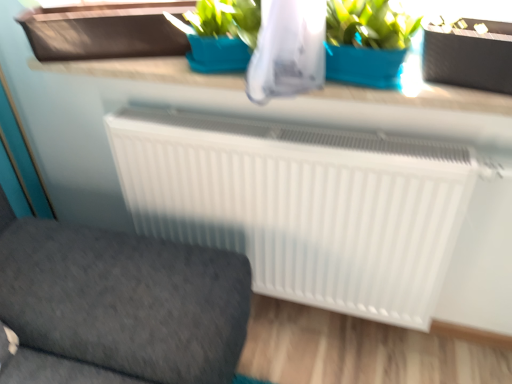
What is the approximate width of white smooth counter top at upper center?

The width of white smooth counter top at upper center is 8.83 inches.

Locate an element on the screen. brown matte window box at upper left is located at coordinates click(x=105, y=31).

This screenshot has width=512, height=384. Describe the element at coordinates (118, 305) in the screenshot. I see `white plastic radiator at center` at that location.

Measure the distance between white plastic radiator at center and camera.

They are 36.86 inches apart.

The height and width of the screenshot is (384, 512). I want to click on black matte flowerpot at upper right, so (468, 59).

Is the depth of white smooth counter top at upper center greater than that of white plastic radiator at center?

That is True.

Is point (393, 108) closer or farther from the camera than point (162, 298)?

Point (393, 108).

Considering the relative positions of white smooth counter top at upper center and white plastic radiator at center in the image provided, is white smooth counter top at upper center to the left of white plastic radiator at center from the viewer's perspective?

No, white smooth counter top at upper center is not to the left of white plastic radiator at center.

Can you confirm if white smooth counter top at upper center is thinner than white plastic radiator at center?

Indeed, white smooth counter top at upper center has a lesser width compared to white plastic radiator at center.

From the picture: Is brown matte window box at upper left oriented away from white plastic radiator at center?

brown matte window box at upper left does not have its back to white plastic radiator at center.

How many degrees apart are the facing directions of brown matte window box at upper left and white plastic radiator at center?

The angle between the facing direction of brown matte window box at upper left and the facing direction of white plastic radiator at center is 68 degrees.

Considering the sizes of objects brown matte window box at upper left and white plastic radiator at center in the image provided, who is bigger, brown matte window box at upper left or white plastic radiator at center?

white plastic radiator at center is bigger.

Is point (509, 42) positioned behind point (400, 129)?

No, (509, 42) is in front of (400, 129).

From a real-world perspective, which object rests below the other?

From a 3D spatial view, white smooth counter top at upper center is below.

Could you tell me if black matte flowerpot at upper right is turned towards white smooth counter top at upper center?

No, black matte flowerpot at upper right is not turned towards white smooth counter top at upper center.

From the image's perspective, would you say white plastic radiator at center is shown under brown matte window box at upper left?

Yes, from the image's perspective, white plastic radiator at center is below brown matte window box at upper left.

Is white plastic radiator at center wider or thinner than brown matte window box at upper left?

In the image, white plastic radiator at center appears to be wider than brown matte window box at upper left.

Is white plastic radiator at center bigger than brown matte window box at upper left?

Yes.

Between white plastic radiator at center and brown matte window box at upper left, which one appears on the right side from the viewer's perspective?

From the viewer's perspective, brown matte window box at upper left appears more on the right side.

In terms of width, does white smooth counter top at upper center look wider or thinner when compared to black matte flowerpot at upper right?

Considering their sizes, white smooth counter top at upper center looks broader than black matte flowerpot at upper right.

In the scene shown: Between white smooth counter top at upper center and black matte flowerpot at upper right, which one has less height?

Standing shorter between the two is white smooth counter top at upper center.

Which is further, (215, 80) or (462, 85)?

The point (215, 80) is farther from the camera.

Is white smooth counter top at upper center positioned with its back to black matte flowerpot at upper right?

No, black matte flowerpot at upper right is not at the back of white smooth counter top at upper center.

Which of these two, black matte flowerpot at upper right or brown matte window box at upper left, stands shorter?

With less height is brown matte window box at upper left.

Does point (457, 37) come behind point (79, 56)?

No.

Can you confirm if black matte flowerpot at upper right is positioned to the right of brown matte window box at upper left?

Yes, black matte flowerpot at upper right is to the right of brown matte window box at upper left.

Could you tell me if black matte flowerpot at upper right is turned towards brown matte window box at upper left?

No, black matte flowerpot at upper right is not turned towards brown matte window box at upper left.

From the picture: From a real-world perspective, is brown matte window box at upper left below white smooth counter top at upper center?

Incorrect, from a real-world perspective, brown matte window box at upper left is higher than white smooth counter top at upper center.

Is brown matte window box at upper left facing towards white smooth counter top at upper center?

No, brown matte window box at upper left is not turned towards white smooth counter top at upper center.

Would you say brown matte window box at upper left contains white smooth counter top at upper center?

No.

Does brown matte window box at upper left appear on the left side of white smooth counter top at upper center?

Indeed, brown matte window box at upper left is positioned on the left side of white smooth counter top at upper center.

In the image, there is a white plastic radiator at center. Identify the location of counter top above it (from the image's perspective). (307, 99).

The image size is (512, 384). Identify the location of window box behind the white plastic radiator at center. [105, 31].

From the image, which object appears to be farther from white smooth counter top at upper center, black matte flowerpot at upper right or brown matte window box at upper left?

black matte flowerpot at upper right is further to white smooth counter top at upper center.

Estimate the real-world distances between objects in this image. Which object is closer to white smooth counter top at upper center, brown matte window box at upper left or black matte flowerpot at upper right?

brown matte window box at upper left.

From the image, which object appears to be nearer to brown matte window box at upper left, black matte flowerpot at upper right or white smooth counter top at upper center?

Among the two, white smooth counter top at upper center is located nearer to brown matte window box at upper left.

Which object lies nearer to the anchor point white plastic radiator at center, white smooth counter top at upper center or brown matte window box at upper left?

white smooth counter top at upper center is positioned closer to the anchor white plastic radiator at center.

When comparing their distances from black matte flowerpot at upper right, does white plastic radiator at center or brown matte window box at upper left seem closer?

brown matte window box at upper left.

Based on the photo, looking at the image, which one is located closer to white plastic radiator at center, black matte flowerpot at upper right or white smooth counter top at upper center?

The object closer to white plastic radiator at center is white smooth counter top at upper center.

From the image, which object appears to be nearer to black matte flowerpot at upper right, brown matte window box at upper left or white smooth counter top at upper center?

white smooth counter top at upper center lies closer to black matte flowerpot at upper right than the other object.

Based on their spatial positions, is white smooth counter top at upper center or black matte flowerpot at upper right closer to white plastic radiator at center?

white smooth counter top at upper center is positioned closer to the anchor white plastic radiator at center.

Locate an element on the screen. The image size is (512, 384). window box between white plastic radiator at center and black matte flowerpot at upper right from left to right is located at coordinates (105, 31).

Identify the location of counter top between white plastic radiator at center and black matte flowerpot at upper right from left to right. The height and width of the screenshot is (384, 512). (307, 99).

I want to click on counter top between brown matte window box at upper left and black matte flowerpot at upper right from left to right, so click(x=307, y=99).

This screenshot has height=384, width=512. Find the location of `counter top that lies between brown matte window box at upper left and white plastic radiator at center from top to bottom`. counter top that lies between brown matte window box at upper left and white plastic radiator at center from top to bottom is located at coordinates (307, 99).